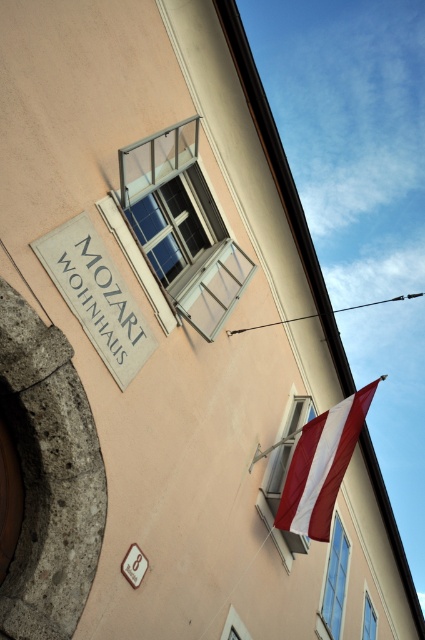
Question: Is clear glass window at upper center wider than transparent glass window at upper center?

Choices:
 (A) yes
 (B) no

Answer: (A)

Question: Which point is farther from the camera taking this photo?

Choices:
 (A) (308, 541)
 (B) (371, 628)
 (C) (206, 227)

Answer: (B)

Question: Can you confirm if clear glass window at upper center is bigger than transparent glass window at upper center?

Choices:
 (A) yes
 (B) no

Answer: (A)

Question: Which point is closer to the camera?

Choices:
 (A) clear glass window at lower right
 (B) matte glass window at lower right
 (C) clear glass window at upper center
 (D) red/white striped fabric at lower right

Answer: (C)

Question: Which is farther from the red/white striped fabric at lower right?

Choices:
 (A) clear glass window at upper center
 (B) clear glass window at lower right
 (C) transparent glass window at upper center

Answer: (C)

Question: Does matte glass window at lower right appear under transparent glass window at upper center?

Choices:
 (A) yes
 (B) no

Answer: (B)